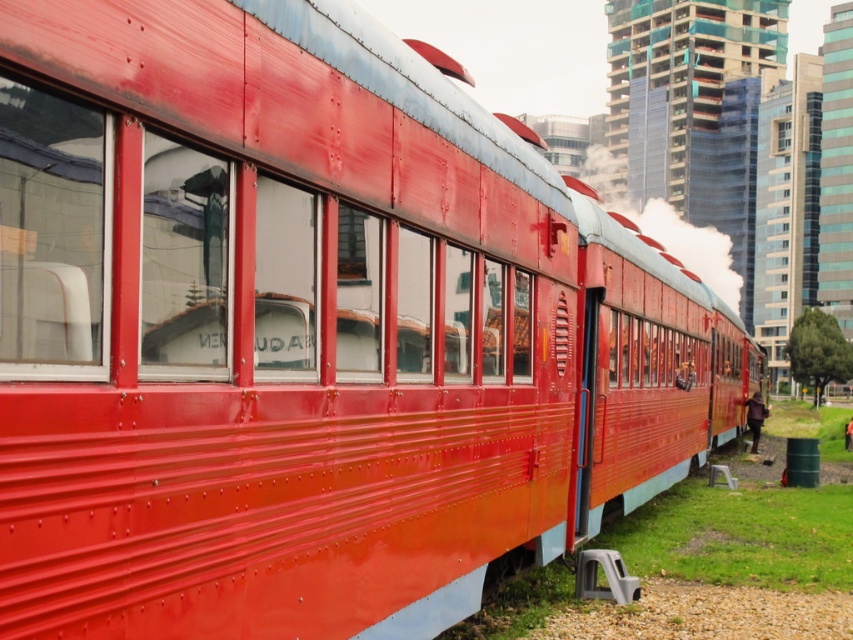
You are a passenger on the red train car and notice the cracked glass window at center and the dark brown leather jacket at lower right. Which object is shorter in height?

The cracked glass window at center has a lesser height compared to the dark brown leather jacket at lower right, so the cracked glass window at center is shorter.

You are a maintenance worker on a train. You need to reach the cracked glass window at center to repair it. You are currently standing next to the orange fabric jacket at lower right. Can you walk directly to the window without any obstacles? The train car is 100 feet long.

The cracked glass window at center is 98.12 feet from the orange fabric jacket at lower right. Since the train car is 100 feet long, there is enough space for you to walk directly to the window without obstacles.